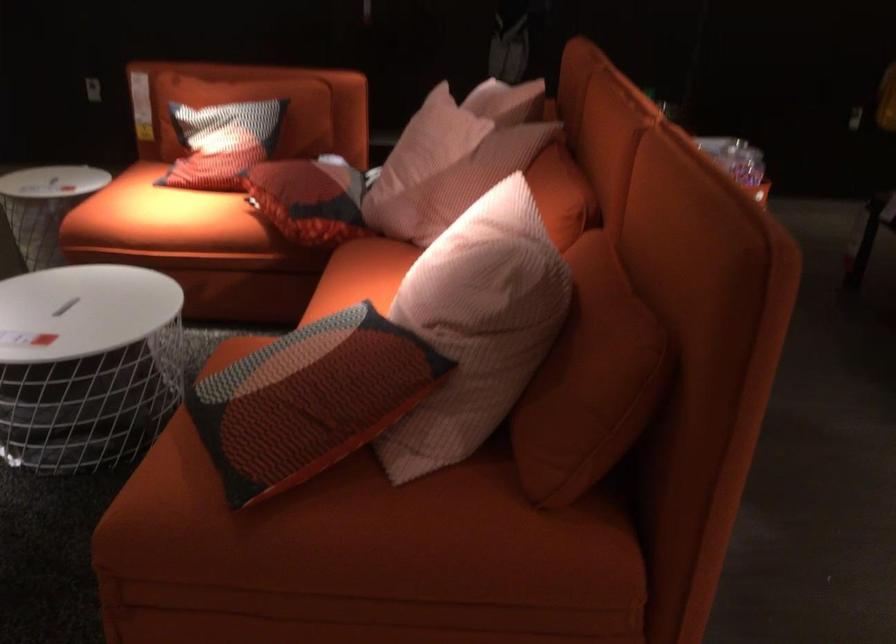
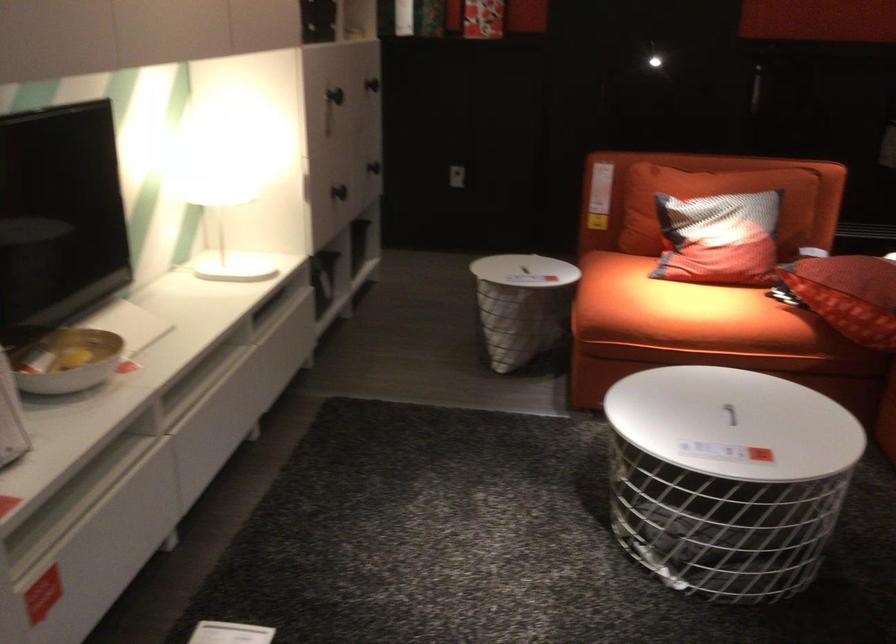
In the second image, find the point that corresponds to (152,218) in the first image.

(684, 312)